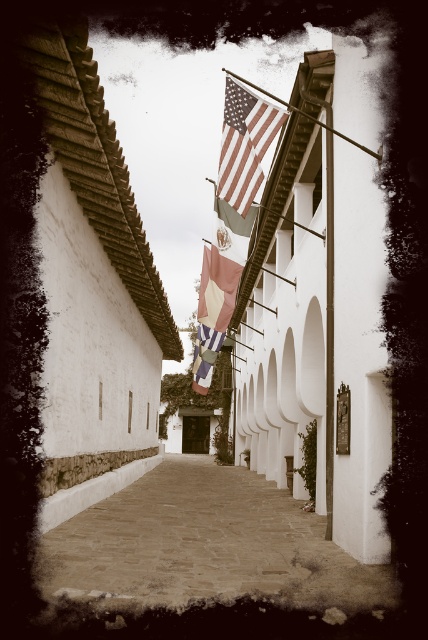
Question: Can you confirm if american flag at upper center is bigger than pink fabric flag at center?

Choices:
 (A) no
 (B) yes

Answer: (A)

Question: Can you confirm if smooth stone alley at center is bigger than american flag at upper center?

Choices:
 (A) yes
 (B) no

Answer: (A)

Question: Among these objects, which one is nearest to the camera?

Choices:
 (A) metallic flag pole at upper center
 (B) pink fabric flag at center

Answer: (A)

Question: Which object is the closest to the smooth stone alley at center?

Choices:
 (A) pink fabric flag at center
 (B) american flag at upper center

Answer: (A)

Question: Is american flag at upper center above pink fabric flag at center?

Choices:
 (A) no
 (B) yes

Answer: (B)

Question: Which point appears farthest from the camera in this image?

Choices:
 (A) (344, 140)
 (B) (237, 148)

Answer: (B)